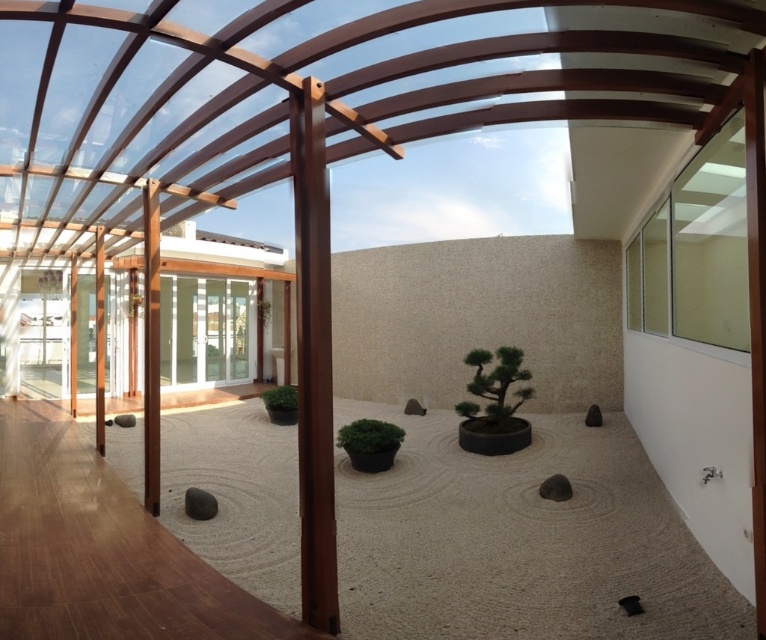
Question: Does green matte bonsai at center have a greater width compared to green matte plant at center?

Choices:
 (A) no
 (B) yes

Answer: (B)

Question: Is green matte bonsai at center positioned before green matte plant at center?

Choices:
 (A) no
 (B) yes

Answer: (A)

Question: Does green matte bonsai at center appear over green matte plant at center?

Choices:
 (A) yes
 (B) no

Answer: (A)

Question: Among these points, which one is nearest to the camera?

Choices:
 (A) (509, 369)
 (B) (362, 449)

Answer: (B)